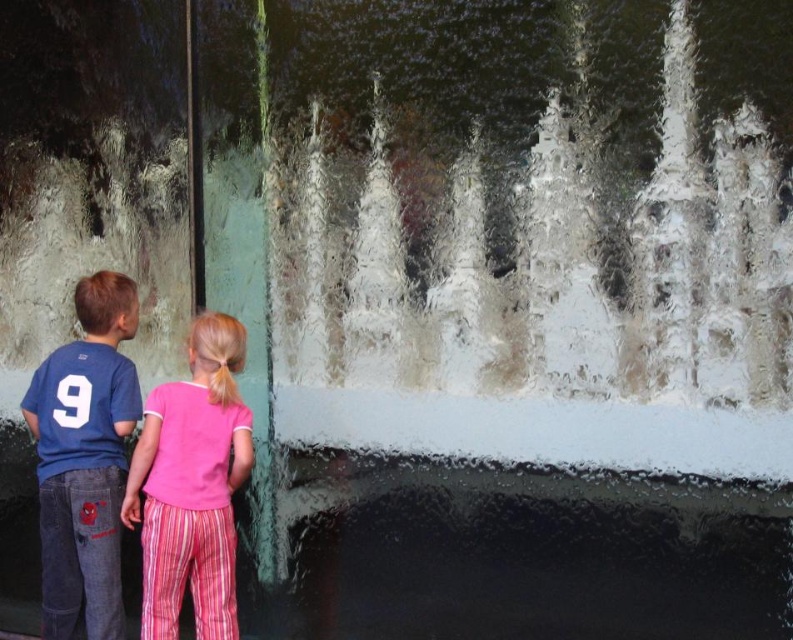
Question: Does blue jersey at center have a smaller size compared to pink cotton shirt at center?

Choices:
 (A) no
 (B) yes

Answer: (A)

Question: From the image, what is the correct spatial relationship of blue jersey at center in relation to pink cotton shirt at center?

Choices:
 (A) above
 (B) below

Answer: (A)

Question: Among these objects, which one is farthest from the camera?

Choices:
 (A) pink cotton shirt at center
 (B) blue jersey at center

Answer: (B)

Question: Considering the relative positions of blue jersey at center and pink cotton shirt at center in the image provided, where is blue jersey at center located with respect to pink cotton shirt at center?

Choices:
 (A) below
 (B) above

Answer: (B)

Question: Which of the following is the farthest from the observer?

Choices:
 (A) (140, 412)
 (B) (213, 547)

Answer: (A)

Question: Which object appears farthest from the camera in this image?

Choices:
 (A) blue jersey at center
 (B) pink cotton shirt at center

Answer: (A)